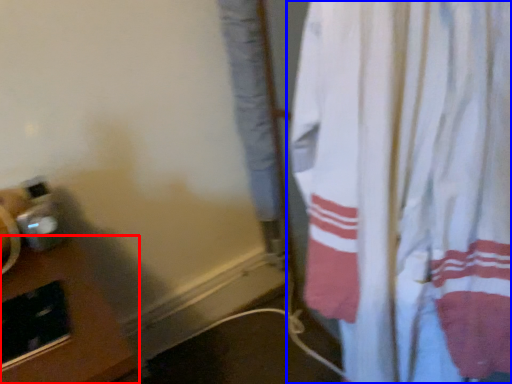
Question: Which point is further to the camera, table (highlighted by a red box) or curtain (highlighted by a blue box)?

Choices:
 (A) table
 (B) curtain

Answer: (A)